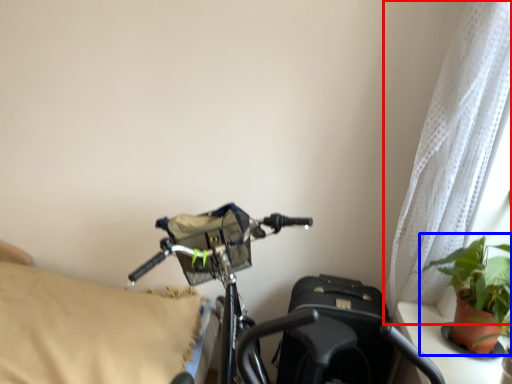
Question: Among these objects, which one is nearest to the camera, curtain (highlighted by a red box) or houseplant (highlighted by a blue box)?

Choices:
 (A) curtain
 (B) houseplant

Answer: (B)